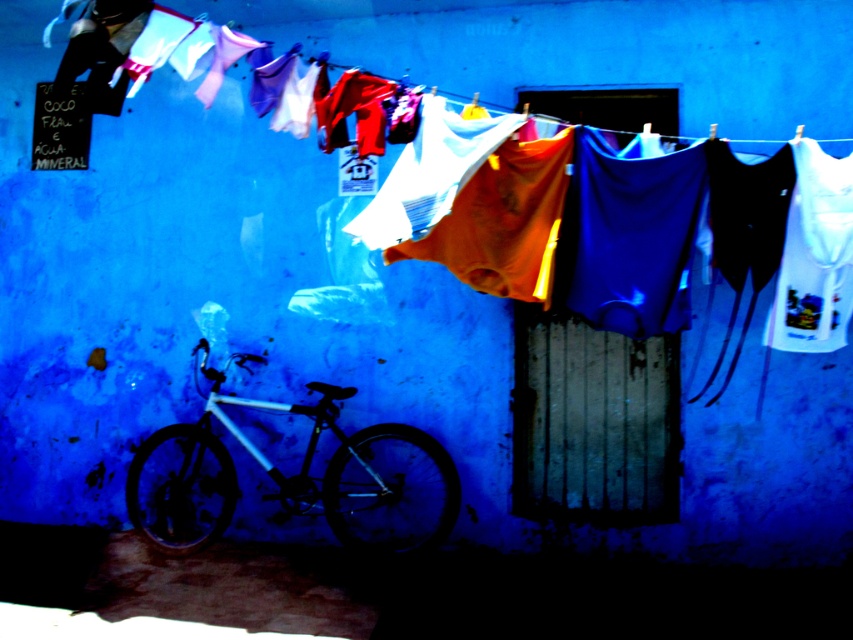
Question: Observing the image, what is the correct spatial positioning of orange fabric at center in reference to white printed t-shirt at right?

Choices:
 (A) below
 (B) above

Answer: (B)

Question: Which point is closer to the camera?

Choices:
 (A) white printed t-shirt at right
 (B) matte fabric clothesline at upper center
 (C) orange fabric at center
 (D) silver metallic bicycle at lower left

Answer: (A)

Question: Which of the following is the farthest from the observer?

Choices:
 (A) white printed t-shirt at right
 (B) silver metallic bicycle at lower left
 (C) matte fabric clothesline at upper center

Answer: (B)

Question: Can you confirm if matte fabric clothesline at upper center is positioned to the right of silver metallic bicycle at lower left?

Choices:
 (A) yes
 (B) no

Answer: (A)

Question: Is matte fabric clothesline at upper center to the right of silver metallic bicycle at lower left from the viewer's perspective?

Choices:
 (A) yes
 (B) no

Answer: (A)

Question: Which point is closer to the camera?

Choices:
 (A) (323, 474)
 (B) (770, 97)
 (C) (370, 339)
 (D) (792, 147)

Answer: (D)